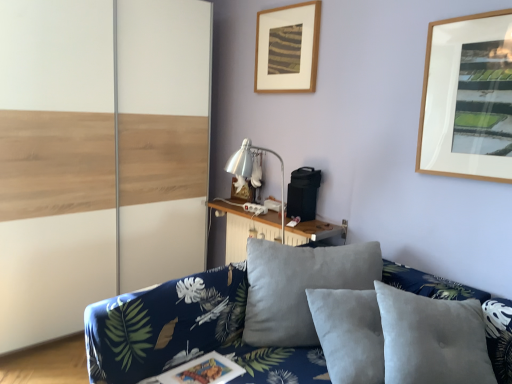
In order to face wooden table at center, should I rotate leftwards or rightwards?

Rotate your view right by about 1.559°.

Describe the element at coordinates (287, 48) in the screenshot. I see `wooden picture frame at upper center, which is the 2th picture frame in left-to-right order` at that location.

Find the location of a particular element. Image resolution: width=512 pixels, height=384 pixels. blue floral fabric couch at lower center is located at coordinates (186, 332).

Where is `suede gray pillow at center`? suede gray pillow at center is located at coordinates (432, 339).

From the image's perspective, who appears lower, wooden picture frame at upper center, arranged as the second picture frame when viewed from the front, or wooden table at center?

wooden table at center.

Is point (244, 190) closer to camera compared to point (229, 225)?

Yes, it is.

Can you confirm if wooden picture frame at upper center, the 2th picture frame in the top-to-bottom sequence, is smaller than wooden table at center?

Yes.

Locate an element on the screen. Image resolution: width=512 pixels, height=384 pixels. table on the right side of wooden picture frame at upper center, the 1th picture frame viewed from the left is located at coordinates (245, 227).

Between white wood barn door at left and wooden table at center, which one has more height?

Standing taller between the two is white wood barn door at left.

Locate an element on the screen. The image size is (512, 384). table on the right of white wood barn door at left is located at coordinates (245, 227).

Is white wood barn door at left inside the boundaries of wooden table at center, or outside?

white wood barn door at left is located beyond the bounds of wooden table at center.

From a real-world perspective, is white wood barn door at left positioned over wooden table at center based on gravity?

Yes, from a real-world perspective, white wood barn door at left is on top of wooden table at center.

From the image's perspective, is suede gray pillow at center beneath wooden table at center?

Indeed, from the image's perspective, suede gray pillow at center is shown beneath wooden table at center.

Considering the sizes of objects suede gray pillow at center and wooden table at center in the image provided, who is taller, suede gray pillow at center or wooden table at center?

Standing taller between the two is suede gray pillow at center.

Is point (426, 318) closer or farther from the camera than point (264, 218)?

Point (426, 318) appears to be closer to the viewer than point (264, 218).

Image resolution: width=512 pixels, height=384 pixels. What are the coordinates of `pillow located in front of the wooden table at center` in the screenshot? It's located at (432, 339).

Which is more to the left, wooden picture frame at upper center, arranged as the 1th picture frame when viewed from the front, or blue floral fabric couch at lower center?

blue floral fabric couch at lower center is more to the left.

Is wooden picture frame at upper center, positioned as the 2th picture frame in back-to-front order, smaller than blue floral fabric couch at lower center?

Correct, wooden picture frame at upper center, positioned as the 2th picture frame in back-to-front order, occupies less space than blue floral fabric couch at lower center.

Which of these two, wooden picture frame at upper center, arranged as the 1th picture frame when viewed from the front, or blue floral fabric couch at lower center, is thinner?

With smaller width is wooden picture frame at upper center, arranged as the 1th picture frame when viewed from the front.

Based on the photo, which is correct: wooden picture frame at upper center, positioned as the 2th picture frame in back-to-front order, is inside blue floral fabric couch at lower center, or outside of it?

wooden picture frame at upper center, positioned as the 2th picture frame in back-to-front order, is outside blue floral fabric couch at lower center.

Which is more to the right, wooden picture frame at upper center, which is the 2th picture frame in left-to-right order, or wooden picture frame at upper center, which is the second picture frame in right-to-left order?

From the viewer's perspective, wooden picture frame at upper center, which is the 2th picture frame in left-to-right order, appears more on the right side.

Is wooden picture frame at upper center, which is the 2th picture frame in left-to-right order, bigger than wooden picture frame at upper center, which is the second picture frame in right-to-left order?

Yes, wooden picture frame at upper center, which is the 2th picture frame in left-to-right order, is bigger than wooden picture frame at upper center, which is the second picture frame in right-to-left order.

How much distance is there between wooden picture frame at upper center, the second picture frame ordered from the bottom, and wooden picture frame at upper center, the 2th picture frame in the top-to-bottom sequence?

A distance of 36.52 inches exists between wooden picture frame at upper center, the second picture frame ordered from the bottom, and wooden picture frame at upper center, the 2th picture frame in the top-to-bottom sequence.

In the scene shown: From a real-world perspective, who is located lower, wooden picture frame at upper center, arranged as the 1th picture frame when viewed from the front, or wooden picture frame at upper center, which is the second picture frame in right-to-left order?

From a 3D spatial view, wooden picture frame at upper center, which is the second picture frame in right-to-left order, is below.

From a real-world perspective, between wooden picture frame at upper center, acting as the first picture frame starting from the back, and blue floral fabric couch at lower center, who is vertically lower?

blue floral fabric couch at lower center is physically lower.

Which point is more forward, (253, 199) or (297, 352)?

The point (297, 352) is closer.

Is wooden picture frame at upper center, the 1th picture frame viewed from the left, spatially inside blue floral fabric couch at lower center, or outside of it?

wooden picture frame at upper center, the 1th picture frame viewed from the left, is located beyond the bounds of blue floral fabric couch at lower center.

In terms of height, does wooden picture frame at upper center, which is the second picture frame in right-to-left order, look taller or shorter compared to blue floral fabric couch at lower center?

In the image, wooden picture frame at upper center, which is the second picture frame in right-to-left order, appears to be shorter than blue floral fabric couch at lower center.

Is white wood barn door at left wider or thinner than blue floral fabric couch at lower center?

white wood barn door at left is thinner than blue floral fabric couch at lower center.

Find the location of a particular element. studio couch that appears below the white wood barn door at left (from the image's perspective) is located at coordinates (186, 332).

Between white wood barn door at left and blue floral fabric couch at lower center, which one is positioned in front?

Positioned in front is blue floral fabric couch at lower center.

Is white wood barn door at left at the right side of blue floral fabric couch at lower center?

No.

I want to click on picture frame on the left of wooden table at center, so click(243, 191).

I want to click on table that is on the right side of white wood barn door at left, so click(245, 227).

When comparing their distances from wooden table at center, does wooden picture frame at upper center, the first picture frame in the top-to-bottom sequence, or wooden picture frame at upper center, arranged as the second picture frame when viewed from the front, seem further?

wooden picture frame at upper center, the first picture frame in the top-to-bottom sequence, is positioned further to the anchor wooden table at center.

From the image, which object appears to be farther from blue floral fabric couch at lower center, wooden picture frame at upper center, the 2th picture frame in the top-to-bottom sequence, or white wood barn door at left?

wooden picture frame at upper center, the 2th picture frame in the top-to-bottom sequence, is positioned further to the anchor blue floral fabric couch at lower center.

Considering their positions, is wooden picture frame at upper center, which ranks as the 1th picture frame in bottom-to-top order, positioned further to wooden picture frame at upper center, the first picture frame in the top-to-bottom sequence, than blue floral fabric couch at lower center?

blue floral fabric couch at lower center is further to wooden picture frame at upper center, the first picture frame in the top-to-bottom sequence.

Based on their spatial positions, is suede gray pillow at center or wooden picture frame at upper center, positioned as the 2th picture frame in back-to-front order, closer to white wood barn door at left?

wooden picture frame at upper center, positioned as the 2th picture frame in back-to-front order, is positioned closer to the anchor white wood barn door at left.

From the image, which object appears to be farther from wooden picture frame at upper center, arranged as the 1th picture frame when viewed from the front, suede gray pillow at center or wooden table at center?

suede gray pillow at center is positioned further to the anchor wooden picture frame at upper center, arranged as the 1th picture frame when viewed from the front.

Which object lies nearer to the anchor point suede gray pillow at center, wooden table at center or white wood barn door at left?

wooden table at center lies closer to suede gray pillow at center than the other object.

Based on their spatial positions, is white wood barn door at left or wooden table at center closer to wooden picture frame at upper center, which ranks as the 1th picture frame in bottom-to-top order?

wooden table at center.

From the image, which object appears to be nearer to wooden picture frame at upper center, the 1th picture frame viewed from the left, wooden picture frame at upper center, the second picture frame ordered from the bottom, or suede gray pillow at center?

wooden picture frame at upper center, the second picture frame ordered from the bottom, lies closer to wooden picture frame at upper center, the 1th picture frame viewed from the left, than the other object.

This screenshot has height=384, width=512. Identify the location of barn door positioned between blue floral fabric couch at lower center and wooden picture frame at upper center, acting as the first picture frame starting from the back, from near to far. (98, 155).

The image size is (512, 384). I want to click on pillow located between blue floral fabric couch at lower center and wooden picture frame at upper center, the 2th picture frame in the top-to-bottom sequence, in the depth direction, so click(x=432, y=339).

The height and width of the screenshot is (384, 512). Find the location of `picture frame between white wood barn door at left and wooden table at center in the horizontal direction`. picture frame between white wood barn door at left and wooden table at center in the horizontal direction is located at coordinates [243, 191].

Find the location of a particular element. The width and height of the screenshot is (512, 384). table between white wood barn door at left and wooden picture frame at upper center, arranged as the 1th picture frame when viewed from the front is located at coordinates (245, 227).